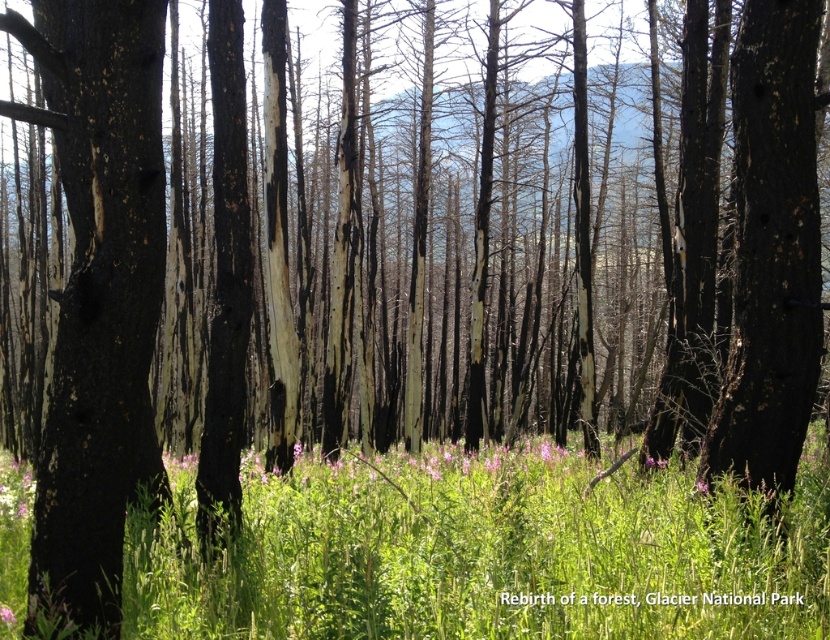
You are a hiker who wants to place a small marker between the green grassy at center and the pink matte flower at center. Based on their positions, where should you place the marker so it is directly between them?

The green grassy at center is positioned under the pink matte flower at center, so placing the marker directly below the pink matte flower at center and above the green grassy at center would position it between them.

You are a hiker who wants to take a photo of the pink matte flower at center without the charred bark tree at center blocking the view. Which direction should you move to ensure the tree is no longer in front of the flower?

The charred bark tree at center is positioned on the right side of pink matte flower at center. To avoid the tree blocking the flower, move to the left side of the flower so the tree is no longer in front.